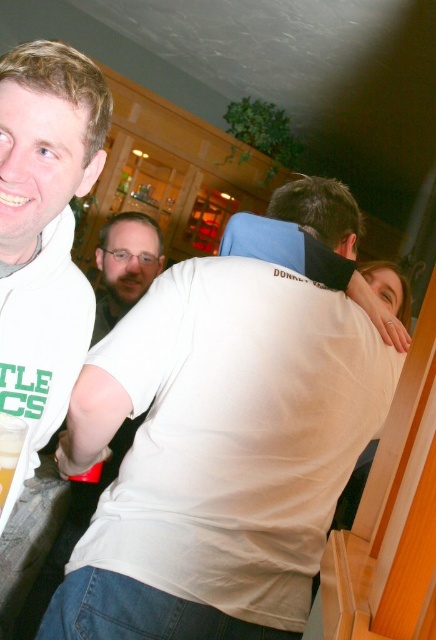
Is point (54, 150) closer to camera compared to point (6, 444)?

No.

Does white matte t-shirt at left have a smaller size compared to translucent glass beer at lower left?

No, white matte t-shirt at left is not smaller than translucent glass beer at lower left.

Find the location of a particular element. Image resolution: width=436 pixels, height=640 pixels. white matte t-shirt at left is located at coordinates (41, 276).